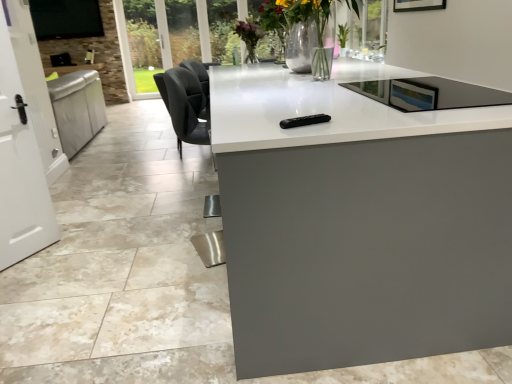
This screenshot has height=384, width=512. In order to click on empty space that is to the right of white glossy door at left in this screenshot , I will do `click(72, 254)`.